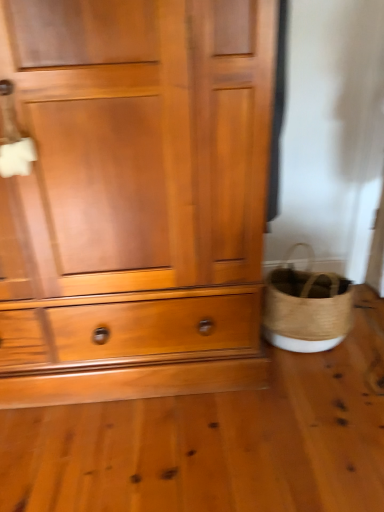
Question: Considering the positions of point [x=288, y=266] and point [x=160, y=333], is point [x=288, y=266] closer or farther from the camera than point [x=160, y=333]?

Choices:
 (A) closer
 (B) farther

Answer: (B)

Question: Looking at their shapes, would you say woven straw basket at lower right is wider or thinner than matte wood chest of drawers at center?

Choices:
 (A) thin
 (B) wide

Answer: (A)

Question: Is woven straw basket at lower right taller or shorter than matte wood chest of drawers at center?

Choices:
 (A) short
 (B) tall

Answer: (A)

Question: Based on their positions, is matte wood chest of drawers at center located to the left or right of woven straw basket at lower right?

Choices:
 (A) left
 (B) right

Answer: (A)

Question: From the image's perspective, is matte wood chest of drawers at center above or below woven straw basket at lower right?

Choices:
 (A) above
 (B) below

Answer: (A)

Question: Considering the positions of matte wood chest of drawers at center and woven straw basket at lower right in the image, is matte wood chest of drawers at center taller or shorter than woven straw basket at lower right?

Choices:
 (A) short
 (B) tall

Answer: (B)

Question: From a real-world perspective, is matte wood chest of drawers at center physically located above or below woven straw basket at lower right?

Choices:
 (A) below
 (B) above

Answer: (B)